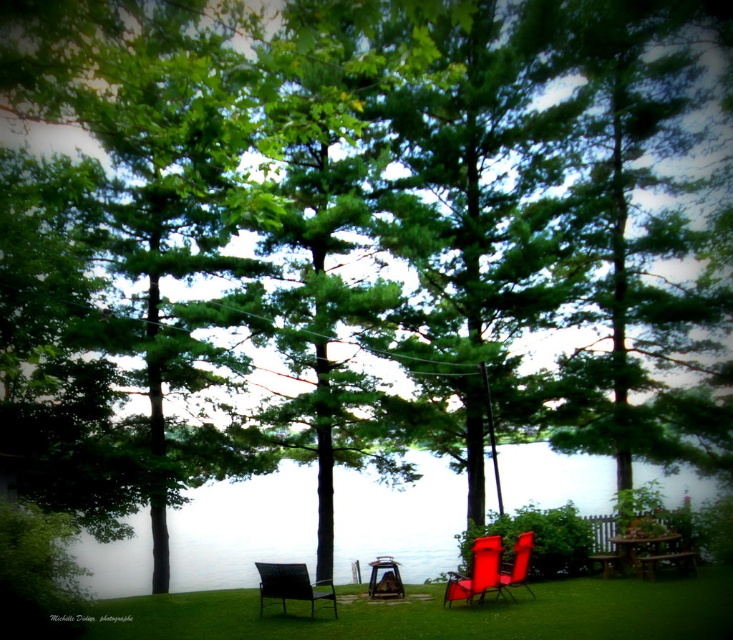
From the picture: Who is more distant from viewer, (497, 540) or (500, 566)?

Point (500, 566)

From the picture: Can you confirm if matte red chair at lower right is thinner than matte red chair at center?

Yes, matte red chair at lower right is thinner than matte red chair at center.

At what (x,y) coordinates should I click in order to perform the action: click on matte red chair at lower right. Please return your answer as a coordinate pair (x, y). The height and width of the screenshot is (640, 733). Looking at the image, I should click on (476, 572).

Does green grass at center have a lesser width compared to matte red chair at center?

No.

Who is more distant from viewer, (663, 609) or (500, 564)?

Point (500, 564)

I want to click on green grass at center, so click(x=442, y=612).

Does point (265, 570) come behind point (465, 586)?

No, it is in front of (465, 586).

Does metallic silver chair at lower left have a greater width compared to matte red chair at lower right?

No, metallic silver chair at lower left is not wider than matte red chair at lower right.

Is point (268, 563) positioned before point (471, 573)?

No, it is behind (471, 573).

You are a GUI agent. You are given a task and a screenshot of the screen. Output one action in this format:
    pyautogui.click(x=<x>, y=<y>)
    Task: Click on the metallic silver chair at lower left
    
    Given the screenshot: What is the action you would take?
    pyautogui.click(x=290, y=586)